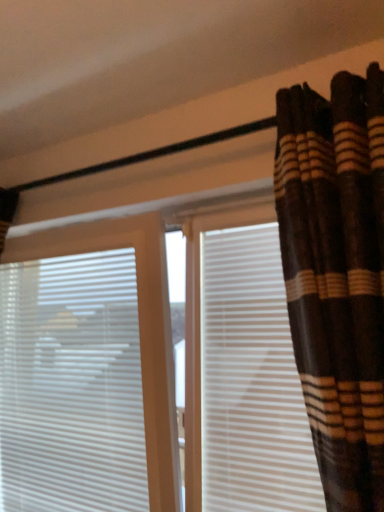
The image size is (384, 512). Find the location of `brown striped fabric at upper right`. brown striped fabric at upper right is located at coordinates (337, 275).

You are a GUI agent. You are given a task and a screenshot of the screen. Output one action in this format:
    pyautogui.click(x=<x>, y=<y>)
    Task: Click on the white matte shutter at right
    Image resolution: width=384 pixels, height=512 pixels.
    Given the screenshot: What is the action you would take?
    pos(251,380)

Where is `brown striped fabric at upper right`? This screenshot has height=512, width=384. brown striped fabric at upper right is located at coordinates (337, 275).

In the scene shown: Is white plastic blinds at left bigger or smaller than brown striped fabric at upper right?

white plastic blinds at left is smaller than brown striped fabric at upper right.

Is white plastic blinds at left oriented towards brown striped fabric at upper right?

No.

Considering the sizes of objects white plastic blinds at left and brown striped fabric at upper right in the image provided, who is thinner, white plastic blinds at left or brown striped fabric at upper right?

white plastic blinds at left.

Considering the points (137, 452) and (316, 355), which point is behind, point (137, 452) or point (316, 355)?

The point (137, 452) is behind.

Who is bigger, brown striped fabric at upper right or white plastic blinds at left?

brown striped fabric at upper right.

Between brown striped fabric at upper right and white plastic blinds at left, which one has smaller width?

With smaller width is white plastic blinds at left.

Considering their positions, is brown striped fabric at upper right located in front of or behind white plastic blinds at left?

In the image, brown striped fabric at upper right appears in front of white plastic blinds at left.

Are brown striped fabric at upper right and white plastic blinds at left far apart?

No.

From a real-world perspective, who is located lower, white matte shutter at right or white plastic blinds at left?

white plastic blinds at left is physically lower.

Find the location of a particular element. This screenshot has height=512, width=384. window blind that is below the white matte shutter at right (from the image's perspective) is located at coordinates coord(87,370).

Which is more to the right, white matte shutter at right or white plastic blinds at left?

white matte shutter at right.

Considering the relative sizes of white matte shutter at right and white plastic blinds at left in the image provided, is white matte shutter at right taller than white plastic blinds at left?

No.

Is white matte shutter at right completely or partially inside white plastic blinds at left?

No, white matte shutter at right is not a part of white plastic blinds at left.

Does white plastic blinds at left have a larger size compared to white matte shutter at right?

Yes, white plastic blinds at left is bigger than white matte shutter at right.

Is white plastic blinds at left shorter than white matte shutter at right?

No.

The height and width of the screenshot is (512, 384). Find the location of `shutter above the white plastic blinds at left (from a real-world perspective)`. shutter above the white plastic blinds at left (from a real-world perspective) is located at coordinates (251, 380).

Does white matte shutter at right have a larger size compared to brown striped fabric at upper right?

Actually, white matte shutter at right might be smaller than brown striped fabric at upper right.

Is white matte shutter at right located outside brown striped fabric at upper right?

Yes, white matte shutter at right is outside of brown striped fabric at upper right.

Which is closer, [206,284] or [284,103]?

Positioned in front is point [284,103].

How many degrees apart are the facing directions of white matte shutter at right and brown striped fabric at upper right?

The facing directions of white matte shutter at right and brown striped fabric at upper right are 3.84 degrees apart.

Does point (321, 158) come in front of point (225, 470)?

Yes, it is.

What's the angular difference between brown striped fabric at upper right and white matte shutter at right's facing directions?

The angle between the facing direction of brown striped fabric at upper right and the facing direction of white matte shutter at right is 3.84 degrees.

Considering the relative positions of brown striped fabric at upper right and white matte shutter at right in the image provided, is brown striped fabric at upper right to the left or to the right of white matte shutter at right?

Clearly, brown striped fabric at upper right is on the right of white matte shutter at right in the image.

Where is `curtain located in front of the white plastic blinds at left`? curtain located in front of the white plastic blinds at left is located at coordinates (337, 275).

Find the location of a particular element. curtain that appears above the white plastic blinds at left (from a real-world perspective) is located at coordinates (337, 275).

Based on their spatial positions, is white matte shutter at right or white plastic blinds at left closer to brown striped fabric at upper right?

Among the two, white matte shutter at right is located nearer to brown striped fabric at upper right.

When comparing their distances from white plastic blinds at left, does white matte shutter at right or brown striped fabric at upper right seem further?

brown striped fabric at upper right lies further to white plastic blinds at left than the other object.

From the image, which object appears to be nearer to white matte shutter at right, white plastic blinds at left or brown striped fabric at upper right?

The object closer to white matte shutter at right is white plastic blinds at left.

Considering their positions, is white plastic blinds at left positioned closer to brown striped fabric at upper right than white matte shutter at right?

Based on the image, white matte shutter at right appears to be nearer to brown striped fabric at upper right.

Estimate the real-world distances between objects in this image. Which object is closer to white matte shutter at right, brown striped fabric at upper right or white plastic blinds at left?

white plastic blinds at left.

Based on their spatial positions, is brown striped fabric at upper right or white matte shutter at right closer to white plastic blinds at left?

white matte shutter at right is positioned closer to the anchor white plastic blinds at left.

Locate an element on the screen. shutter situated between white plastic blinds at left and brown striped fabric at upper right from left to right is located at coordinates (251, 380).